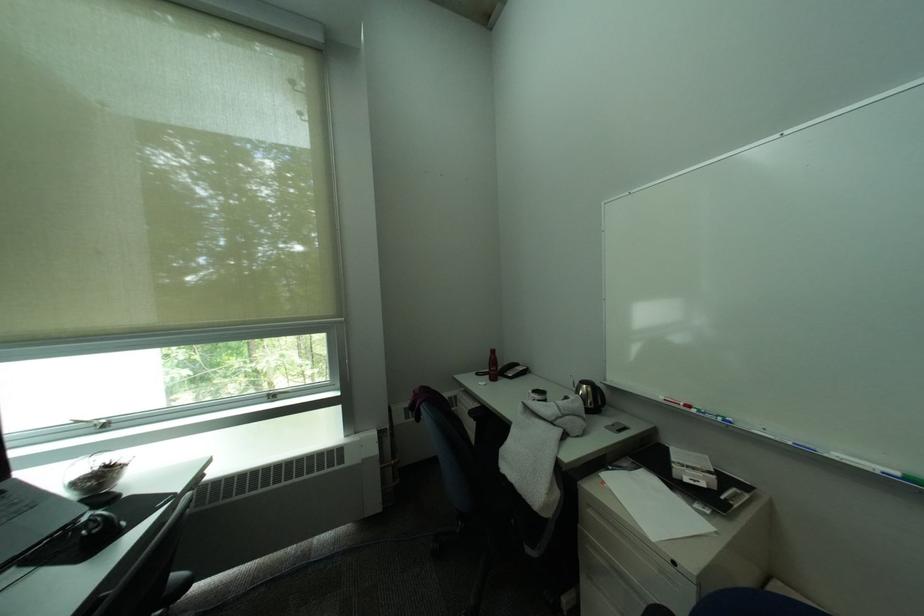
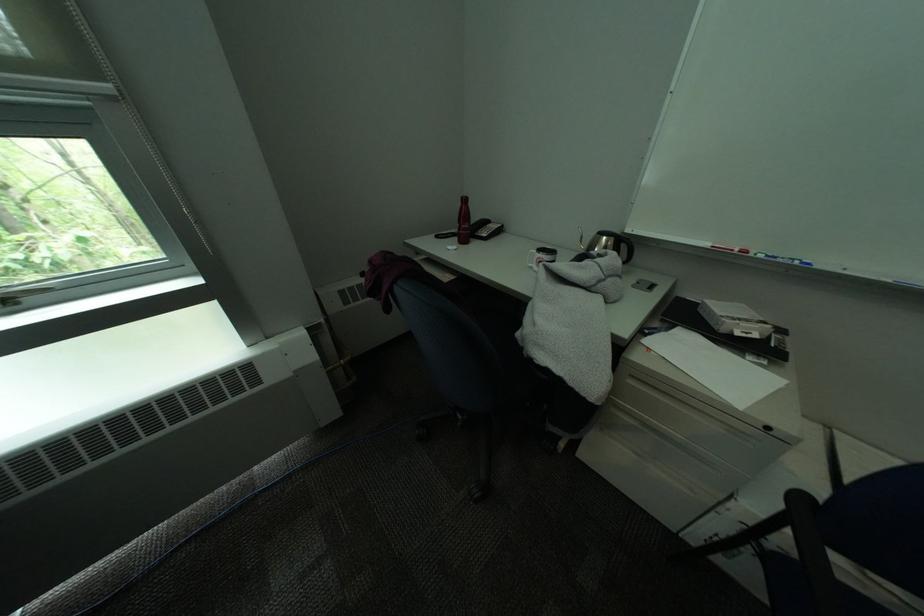
The point at (284, 397) is marked in the first image. Where is the corresponding point in the second image?

(15, 302)